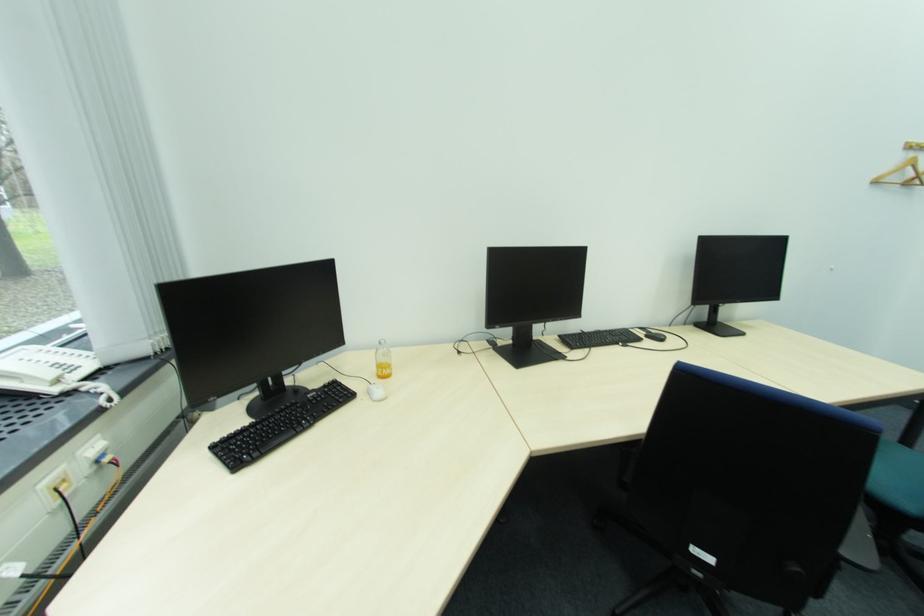
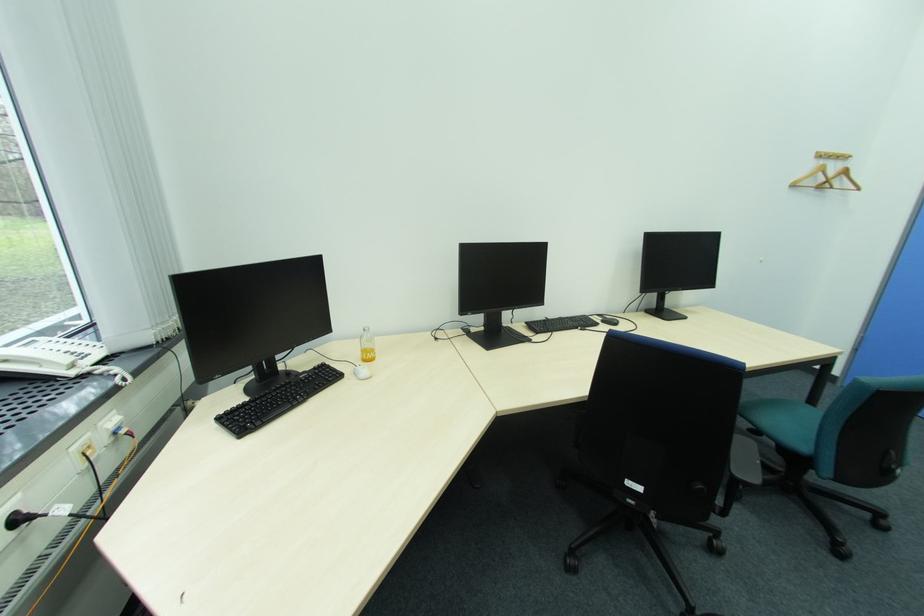
Locate, in the second image, the point that corresponds to (x=649, y=334) in the first image.

(604, 320)